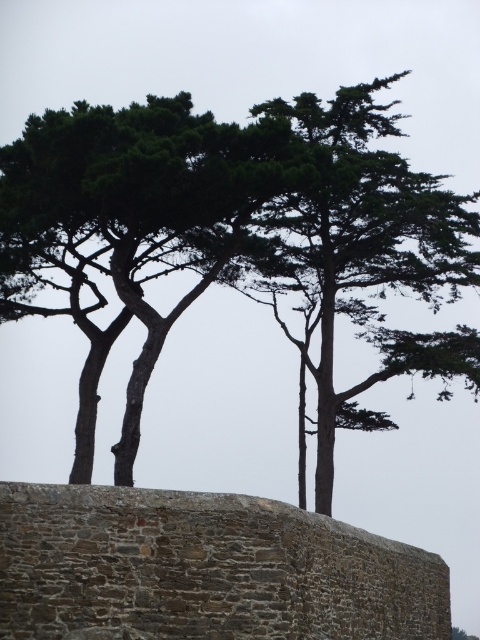
Who is lower down, brown stone wall at center or green textured tree at center?

brown stone wall at center is lower down.

Who is positioned more to the left, brown stone wall at center or green textured tree at center?

Positioned to the left is brown stone wall at center.

Is point (3, 500) positioned in front of point (388, 422)?

Yes.

Where is `brown stone wall at center`? The height and width of the screenshot is (640, 480). brown stone wall at center is located at coordinates pos(204,570).

Looking at this image, is green textured tree at upper center to the right of green textured tree at center from the viewer's perspective?

Incorrect, green textured tree at upper center is not on the right side of green textured tree at center.

Based on the photo, which of these two, green textured tree at upper center or green textured tree at center, stands shorter?

With less height is green textured tree at upper center.

Locate an element on the screen. The image size is (480, 640). green textured tree at upper center is located at coordinates (133, 218).

Which is below, brown stone wall at center or green textured tree at upper center?

brown stone wall at center

Can you confirm if brown stone wall at center is bigger than green textured tree at upper center?

No, brown stone wall at center is not bigger than green textured tree at upper center.

Looking at this image, who is more distant from viewer, (23, 483) or (173, 161)?

Positioned behind is point (173, 161).

This screenshot has width=480, height=640. In order to click on brown stone wall at center in this screenshot , I will do `click(204, 570)`.